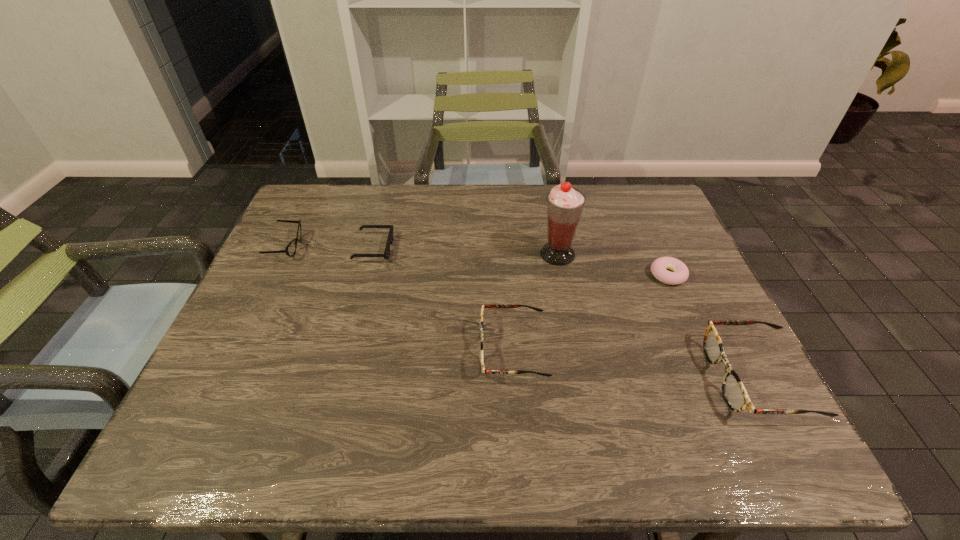
Locate an element on the screen. the fourth object from right to left is located at coordinates (499, 306).

What are the coordinates of `the second tallest object` in the screenshot? It's located at (734, 392).

I want to click on the tallest spectacles, so click(x=734, y=392).

Find the location of `the leftmost spectacles`. the leftmost spectacles is located at coordinates (290, 250).

Locate an element on the screen. The width and height of the screenshot is (960, 540). the fourth tallest object is located at coordinates (290, 250).

This screenshot has width=960, height=540. What are the coordinates of `smoothie` in the screenshot? It's located at (565, 204).

Image resolution: width=960 pixels, height=540 pixels. Find the location of `the fourth object from left to right`. the fourth object from left to right is located at coordinates (565, 204).

Identify the location of the fifth object from right to left. (386, 254).

In order to click on doughnut in this screenshot , I will do `click(680, 274)`.

You are a GUI agent. You are given a task and a screenshot of the screen. Output one action in this format:
    pyautogui.click(x=<x>, y=<y>)
    Task: Click on the free space located 0.280m on the frame of the second spectacles from right to left
    The image size is (960, 540).
    Given the screenshot: What is the action you would take?
    pyautogui.click(x=357, y=349)